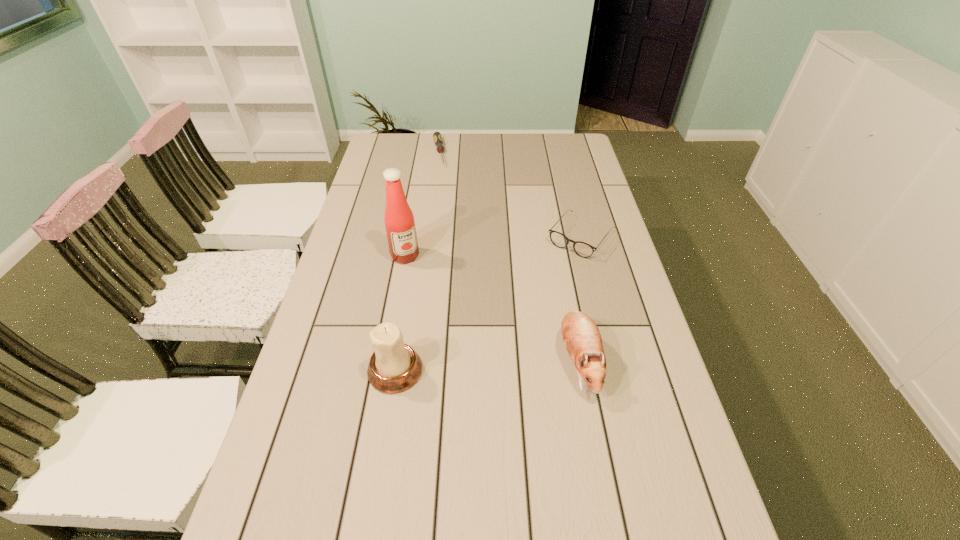
This screenshot has height=540, width=960. Identify the location of vacant space at the far edge of the desktop. (516, 136).

Identify the location of vacant point at the left edge. Image resolution: width=960 pixels, height=540 pixels. (335, 259).

I want to click on vacant space at the right edge, so click(579, 292).

Identify the location of free space at the far left corner of the desktop. (399, 133).

Locate an element on the screen. This screenshot has width=960, height=540. blank space at the far right corner of the desktop is located at coordinates (546, 139).

Locate an element on the screen. The width and height of the screenshot is (960, 540). vacant area that lies between the third shortest object and the farthest object is located at coordinates (509, 256).

The image size is (960, 540). What are the coordinates of `vacant point located between the hamster and the fourth shortest object` in the screenshot? It's located at (487, 366).

Where is `vacant region between the condiment and the second tallest object`? The image size is (960, 540). vacant region between the condiment and the second tallest object is located at coordinates (400, 313).

Where is `empty space that is in between the shortest object and the fourth tallest object`? This screenshot has width=960, height=540. empty space that is in between the shortest object and the fourth tallest object is located at coordinates (510, 195).

Find the location of a particular element. This screenshot has height=540, width=960. free space that is in between the spectacles and the condiment is located at coordinates (493, 246).